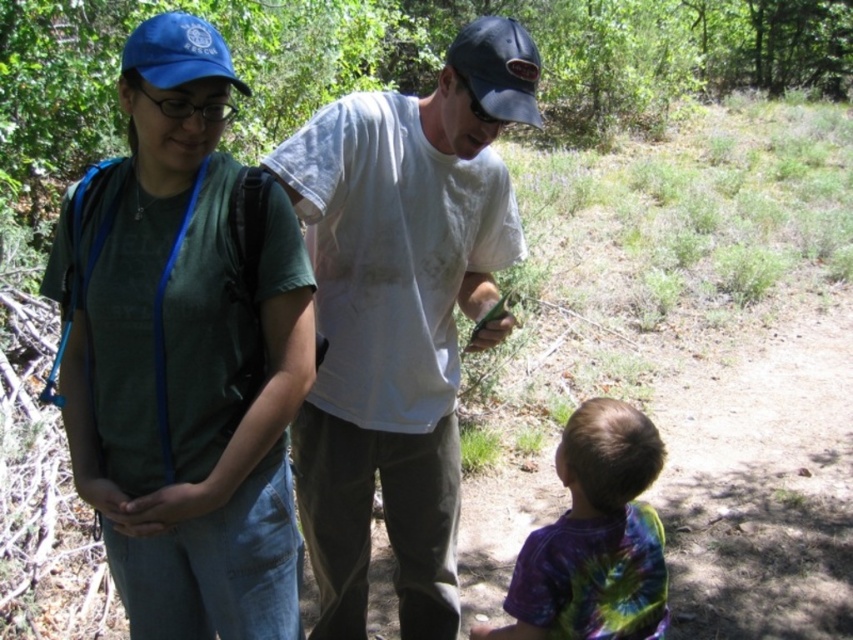
Is the position of tie-dye fabric shirt at lower right less distant than that of blue fabric baseball cap at upper left?

No, tie-dye fabric shirt at lower right is further to the viewer.

Is point (550, 632) positioned in front of point (158, 32)?

No, it is behind (158, 32).

Is point (662, 627) farther from camera compared to point (169, 33)?

Yes, point (662, 627) is behind point (169, 33).

Where is `tie-dye fabric shirt at lower right`? tie-dye fabric shirt at lower right is located at coordinates (595, 538).

Which is below, white cotton shirt at center or blue fabric baseball cap at upper left?

white cotton shirt at center is lower down.

Looking at this image, measure the distance between white cotton shirt at center and blue fabric baseball cap at upper left.

white cotton shirt at center is 35.23 inches away from blue fabric baseball cap at upper left.

At what (x,y) coordinates should I click in order to perform the action: click on white cotton shirt at center. Please return your answer as a coordinate pair (x, y). The width and height of the screenshot is (853, 640). Looking at the image, I should click on (399, 316).

Can you confirm if tie-dye fabric shirt at lower right is positioned above black matte baseball cap at upper center?

No, tie-dye fabric shirt at lower right is not above black matte baseball cap at upper center.

Is tie-dye fabric shirt at lower right thinner than black matte baseball cap at upper center?

In fact, tie-dye fabric shirt at lower right might be wider than black matte baseball cap at upper center.

Which is in front, point (583, 564) or point (502, 90)?

Positioned in front is point (502, 90).

Identify the location of tie-dye fabric shirt at lower right. tap(595, 538).